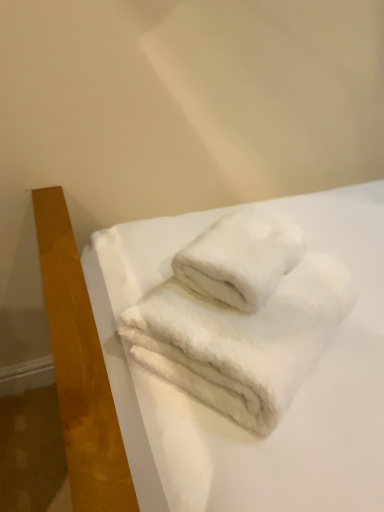
Locate an element on the screen. Image resolution: width=384 pixels, height=512 pixels. white fluffy towel at center is located at coordinates (240, 259).

The image size is (384, 512). Describe the element at coordinates (240, 259) in the screenshot. I see `white fluffy towel at center` at that location.

This screenshot has height=512, width=384. Describe the element at coordinates (296, 396) in the screenshot. I see `white fluffy sheet at center` at that location.

Where is `white fluffy sheet at center`? The height and width of the screenshot is (512, 384). white fluffy sheet at center is located at coordinates (296, 396).

What is the approximate height of white fluffy sheet at center?

white fluffy sheet at center is 6.63 inches in height.

Find the location of a particular element. white fluffy towel at center is located at coordinates (240, 259).

Which object is positioned more to the left, white fluffy towel at center or white fluffy sheet at center?

white fluffy towel at center is more to the left.

Between white fluffy towel at center and white fluffy sheet at center, which one is positioned in front?

white fluffy sheet at center.

Which is in front, point (262, 257) or point (179, 434)?

The point (179, 434) is more forward.

From the image's perspective, is white fluffy towel at center positioned above or below white fluffy sheet at center?

From the image's perspective, white fluffy towel at center appears above white fluffy sheet at center.

From a real-world perspective, is white fluffy towel at center located higher than white fluffy sheet at center?

Yes, from a real-world perspective, white fluffy towel at center is on top of white fluffy sheet at center.

In terms of width, does white fluffy towel at center look wider or thinner when compared to white fluffy sheet at center?

Clearly, white fluffy towel at center has less width compared to white fluffy sheet at center.

Does white fluffy towel at center have a lesser height compared to white fluffy sheet at center?

Correct, white fluffy towel at center is not as tall as white fluffy sheet at center.

Based on the photo, considering the relative sizes of white fluffy towel at center and white fluffy sheet at center in the image provided, is white fluffy towel at center bigger than white fluffy sheet at center?

Incorrect, white fluffy towel at center is not larger than white fluffy sheet at center.

Is white fluffy towel at center outside of white fluffy sheet at center?

No, white fluffy towel at center is not outside of white fluffy sheet at center.

Would you consider white fluffy towel at center to be distant from white fluffy sheet at center?

white fluffy towel at center is actually quite close to white fluffy sheet at center.

Does white fluffy towel at center turn towards white fluffy sheet at center?

Yes, white fluffy towel at center faces towards white fluffy sheet at center.

This screenshot has height=512, width=384. I want to click on towel that is behind the white fluffy sheet at center, so click(x=240, y=259).

Which object is positioned more to the right, white fluffy sheet at center or white fluffy towel at center?

Positioned to the right is white fluffy sheet at center.

Considering the positions of objects white fluffy sheet at center and white fluffy towel at center in the image provided, who is behind, white fluffy sheet at center or white fluffy towel at center?

white fluffy towel at center is further from the camera.

Is point (155, 259) in front of point (230, 238)?

No, (155, 259) is further to viewer.

From the image's perspective, who appears lower, white fluffy sheet at center or white fluffy towel at center?

white fluffy sheet at center appears lower in the image.

From a real-world perspective, is white fluffy sheet at center positioned under white fluffy towel at center based on gravity?

Yes.

Is white fluffy sheet at center wider than white fluffy towel at center?

Indeed, white fluffy sheet at center has a greater width compared to white fluffy towel at center.

Considering the relative sizes of white fluffy sheet at center and white fluffy towel at center in the image provided, is white fluffy sheet at center shorter than white fluffy towel at center?

No.

Based on the photo, considering the relative sizes of white fluffy sheet at center and white fluffy towel at center in the image provided, is white fluffy sheet at center smaller than white fluffy towel at center?

No, white fluffy sheet at center is not smaller than white fluffy towel at center.

Is white fluffy sheet at center outside of white fluffy towel at center?

That's correct, white fluffy sheet at center is outside of white fluffy towel at center.

Based on the photo, would you consider white fluffy sheet at center to be distant from white fluffy towel at center?

white fluffy sheet at center is near white fluffy towel at center, not far away.

Is white fluffy towel at center at the back of white fluffy sheet at center?

No.

How distant is white fluffy sheet at center from white fluffy towel at center?

white fluffy sheet at center and white fluffy towel at center are 7.52 inches apart.

Where is `sheet lying on the right of white fluffy towel at center`? The width and height of the screenshot is (384, 512). sheet lying on the right of white fluffy towel at center is located at coordinates (296, 396).

The width and height of the screenshot is (384, 512). Identify the location of towel behind the white fluffy sheet at center. (240, 259).

Image resolution: width=384 pixels, height=512 pixels. In order to click on towel on the left of white fluffy sheet at center in this screenshot , I will do `click(240, 259)`.